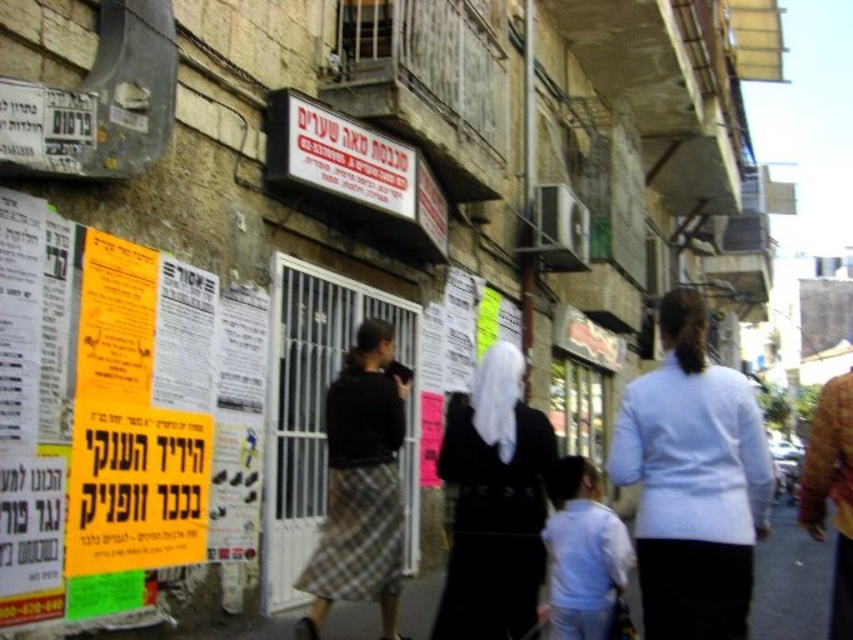
Does light blue fabric at center have a smaller size compared to plaid skirt at center?

Yes.

Between point (730, 385) and point (389, 596), which one is positioned in front?

Point (730, 385)

You are a GUI agent. You are given a task and a screenshot of the screen. Output one action in this format:
    pyautogui.click(x=<x>, y=<y>)
    Task: Click on the light blue fabric at center
    
    Given the screenshot: What is the action you would take?
    pyautogui.click(x=692, y=481)

Between point (479, 490) and point (553, 531), which one is positioned behind?

Positioned behind is point (553, 531).

This screenshot has width=853, height=640. In order to click on dark blue dress at center in this screenshot , I will do `click(492, 504)`.

Does light blue fabric at center appear on the left side of matte plastic sign at upper center?

No, light blue fabric at center is not to the left of matte plastic sign at upper center.

Find the location of a particular element. light blue fabric at center is located at coordinates (692, 481).